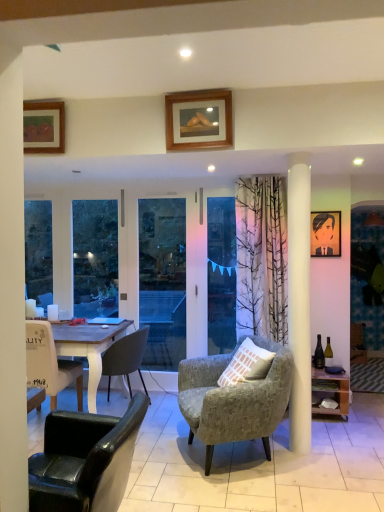
Question: Is wooden picture frame at right, the first picture frame viewed from the right, spatially inside transparent plastic window screen at center, or outside of it?

Choices:
 (A) outside
 (B) inside

Answer: (A)

Question: Is wooden picture frame at right, arranged as the fourth picture frame when viewed from the left, to the left or to the right of transparent plastic window screen at center in the image?

Choices:
 (A) right
 (B) left

Answer: (A)

Question: Considering the real-world distances, which object is farthest from the dark gray fabric chair at lower left, placed as the 3th chair when sorted from front to back?

Choices:
 (A) wooden picture frame at right, which is the 1th picture frame in bottom-to-top order
 (B) white matte coffee cup at left
 (C) leather-like black chair at lower left, positioned as the third chair in back-to-front order
 (D) matte black portrait at upper right, which is counted as the 2th picture frame, starting from the right
 (E) wooden-framed artwork at upper left, the third picture frame when ordered from back to front

Answer: (A)

Question: Which of these objects is positioned closest to the white matte coffee cup at left?

Choices:
 (A) transparent plastic window screen at center
 (B) matte black portrait at upper right, positioned as the 2th picture frame in bottom-to-top order
 (C) leather-like black chair at lower left, positioned as the third chair in back-to-front order
 (D) wooden-framed artwork at upper left, which is the 2th picture frame from front to back
 (E) wooden shelf at right

Answer: (D)